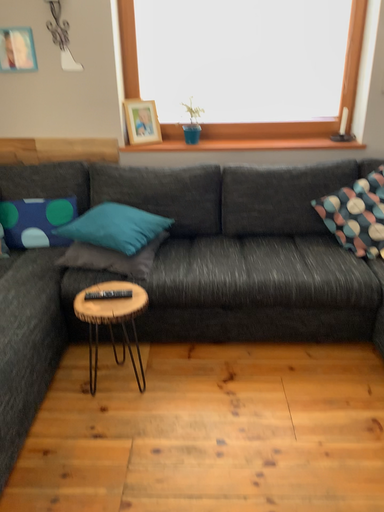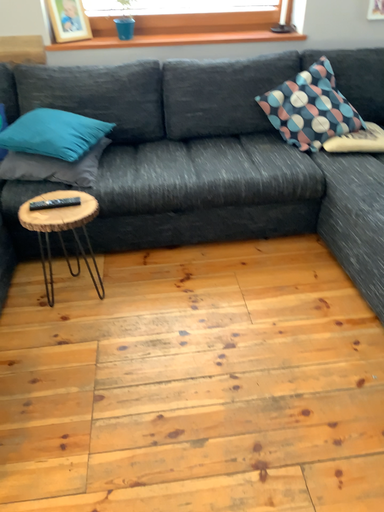
Question: How did the camera likely rotate when shooting the video?

Choices:
 (A) rotated downward
 (B) rotated upward

Answer: (A)